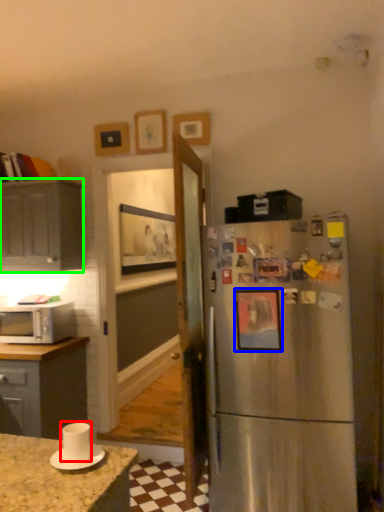
Question: Estimate the real-world distances between objects in this image. Which object is farther from appliance (highlighted by a red box), picture frame (highlighted by a blue box) or cabinetry (highlighted by a green box)?

Choices:
 (A) picture frame
 (B) cabinetry

Answer: (B)